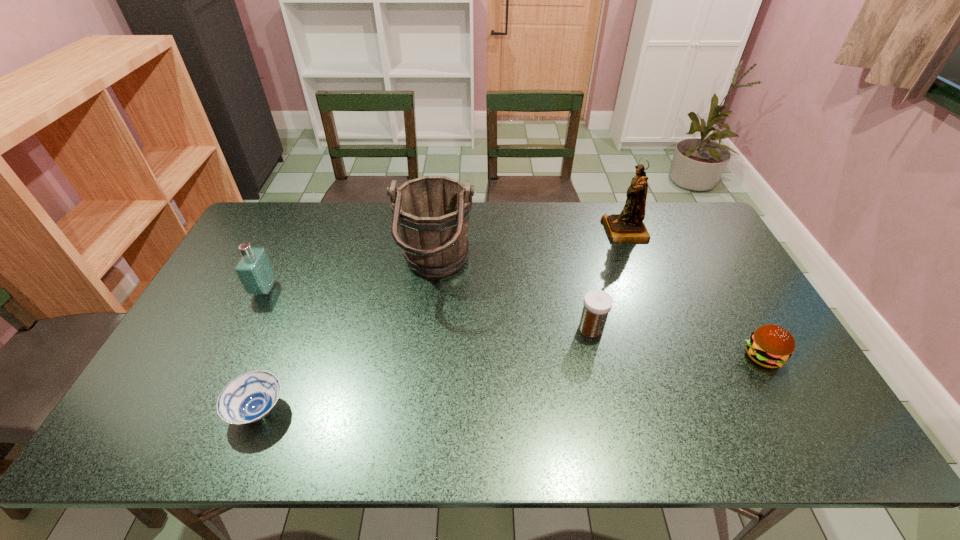
At what (x,y) coordinates should I click in order to perform the action: click on vacant position located 0.210m on the handle side of the third object from left to right. Please return your answer as a coordinate pair (x, y). This screenshot has width=960, height=540. Looking at the image, I should click on (540, 269).

Find the location of a particular element. The width and height of the screenshot is (960, 540). free space located on the front-facing side of the figurine is located at coordinates coord(521,231).

The image size is (960, 540). Find the location of `free location located on the front-facing side of the figurine`. free location located on the front-facing side of the figurine is located at coordinates (516, 231).

The height and width of the screenshot is (540, 960). In order to click on vacant space located 0.290m on the front-facing side of the figurine in this screenshot , I will do `click(521, 231)`.

At what (x,y) coordinates should I click in order to perform the action: click on free region located 0.230m on the front label of the leftmost object. Please return your answer as a coordinate pair (x, y). Looking at the image, I should click on (350, 289).

At what (x,y) coordinates should I click in order to perform the action: click on vacant space located 0.200m on the right of the third shortest object. Please return your answer as a coordinate pair (x, y). This screenshot has height=540, width=960. Looking at the image, I should click on (676, 328).

Find the location of `free space located on the left of the hamburger`. free space located on the left of the hamburger is located at coordinates [x=594, y=356].

Locate an element on the screen. This screenshot has width=960, height=540. vacant space located on the back of the fifth object from right to left is located at coordinates (300, 305).

Find the location of a particular element. bucket located in the far edge section of the desktop is located at coordinates (431, 213).

Image resolution: width=960 pixels, height=540 pixels. What are the coordinates of `figurine that is at the far edge` in the screenshot? It's located at (628, 226).